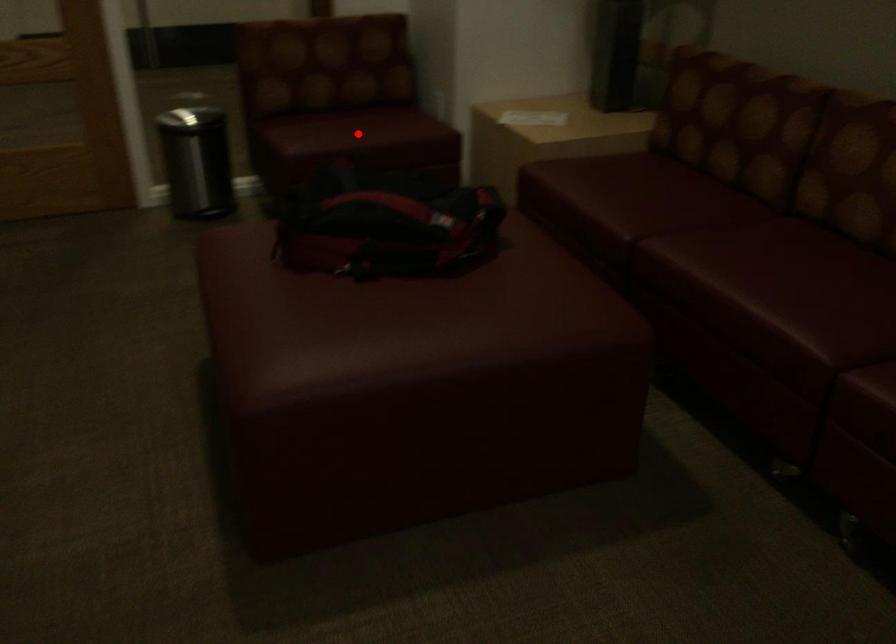
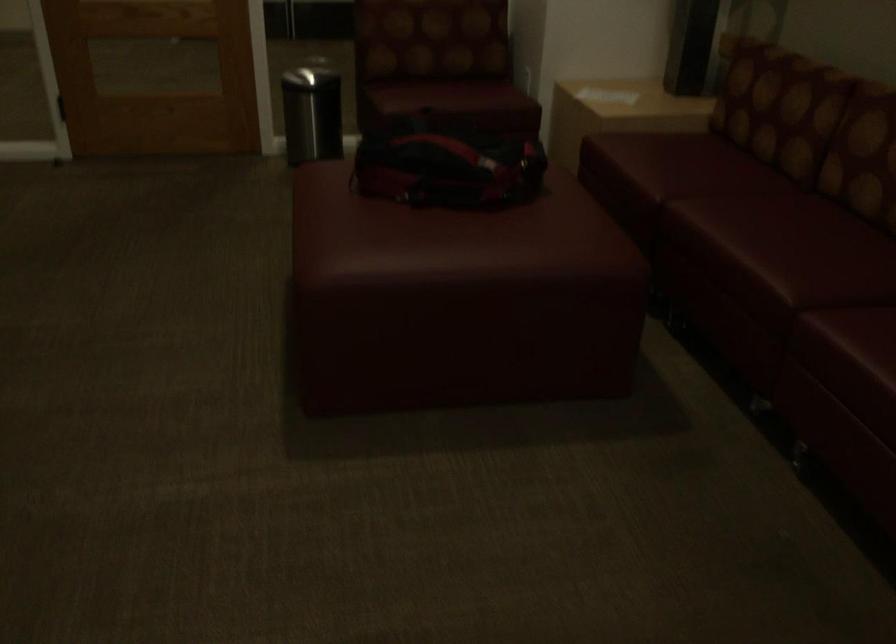
Question: A red point is marked in image1. In image2, is the corresponding 3D point closer to the camera or farther? Reply with the corresponding letter.

Choices:
 (A) The corresponding 3D point is closer.
 (B) The corresponding 3D point is farther.

Answer: (B)